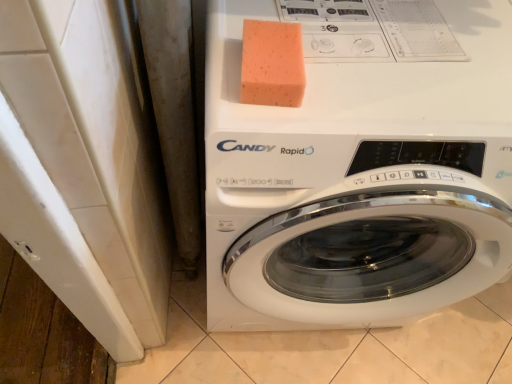
Question: From a real-world perspective, relative to orange sponge at upper center, is white glossy washing machine at center vertically above or below?

Choices:
 (A) above
 (B) below

Answer: (B)

Question: In terms of width, does white glossy washing machine at center look wider or thinner when compared to orange sponge at upper center?

Choices:
 (A) thin
 (B) wide

Answer: (B)

Question: In the image, is white glossy washing machine at center positioned in front of or behind orange sponge at upper center?

Choices:
 (A) front
 (B) behind

Answer: (A)

Question: From their relative heights in the image, would you say orange sponge at upper center is taller or shorter than white glossy washing machine at center?

Choices:
 (A) short
 (B) tall

Answer: (A)

Question: Is orange sponge at upper center inside or outside of white glossy washing machine at center?

Choices:
 (A) inside
 (B) outside

Answer: (A)

Question: Considering the positions of orange sponge at upper center and white glossy washing machine at center in the image, is orange sponge at upper center bigger or smaller than white glossy washing machine at center?

Choices:
 (A) big
 (B) small

Answer: (B)

Question: From a real-world perspective, relative to white glossy washing machine at center, is orange sponge at upper center vertically above or below?

Choices:
 (A) above
 (B) below

Answer: (A)